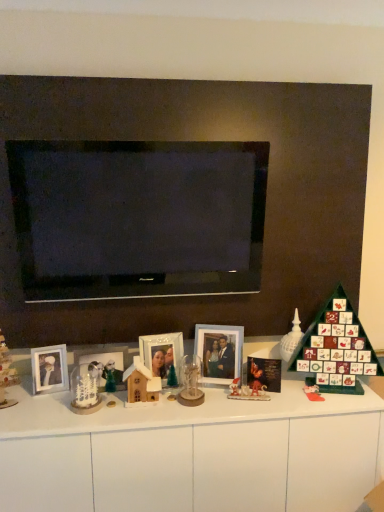
Identify the location of free area below green matte advent calendar at right (from a real-world perspective). The image size is (384, 512). (339, 390).